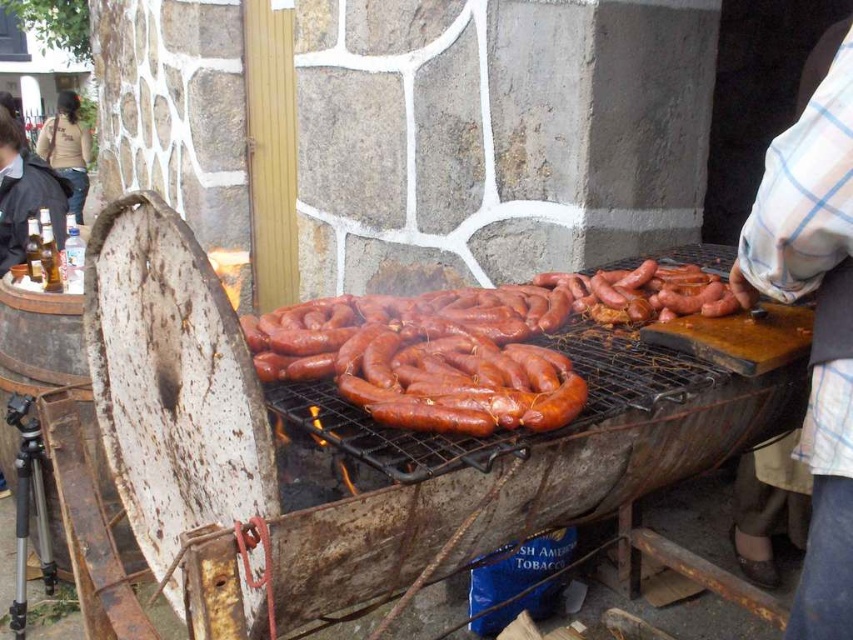
Who is higher up, white checkered shirt at upper right or dark brown shirt at upper left?

Positioned higher is dark brown shirt at upper left.

Does white checkered shirt at upper right appear under dark brown shirt at upper left?

Yes.

Measure the distance between point (x=744, y=307) and camera.

They are 1.78 meters apart.

The height and width of the screenshot is (640, 853). I want to click on white checkered shirt at upper right, so click(814, 324).